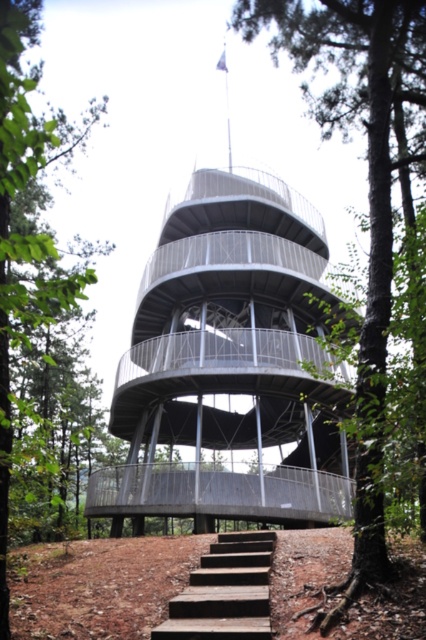
Question: Can you confirm if metallic gray observation tower at center is smaller than wooden stairs at lower center?

Choices:
 (A) yes
 (B) no

Answer: (B)

Question: Does green leafy tree at center have a lesser width compared to wooden stairs at lower center?

Choices:
 (A) yes
 (B) no

Answer: (B)

Question: Can you confirm if metallic gray observation tower at center is thinner than smooth bark tree at center?

Choices:
 (A) no
 (B) yes

Answer: (A)

Question: Which of the following is the closest to the observer?

Choices:
 (A) (16, 246)
 (B) (236, 28)
 (C) (172, 632)

Answer: (A)

Question: Which object is positioned closest to the metallic gray observation tower at center?

Choices:
 (A) wooden stairs at lower center
 (B) smooth bark tree at center

Answer: (B)

Question: Which point appears closest to the camera in this image?

Choices:
 (A) (51, 120)
 (B) (385, 404)
 (C) (215, 292)

Answer: (B)